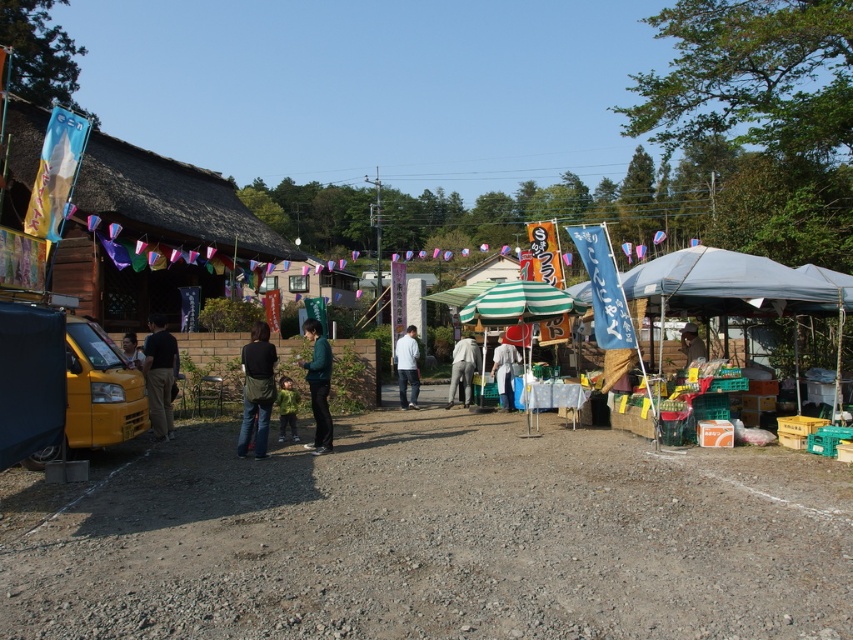
You are standing at the center of the market and want to take a photo that includes both point (316,355) and point (685,352). Which point will appear closer to the bottom of the photo?

Point (316,355) is closer to the camera than point (685,352), so it will appear closer to the bottom of the photo.

You are a photographer standing at the center of the market. You want to take a photo that includes both the dark blue jeans at center and the matte black shirt at left. Since you want to ensure both items are clearly visible in the frame, which object should you adjust your camera focus on to account for their sizes?

The dark blue jeans at center has a lesser width compared to matte black shirt at left, so you should focus on the matte black shirt at left to ensure it is clearly visible in the frame.